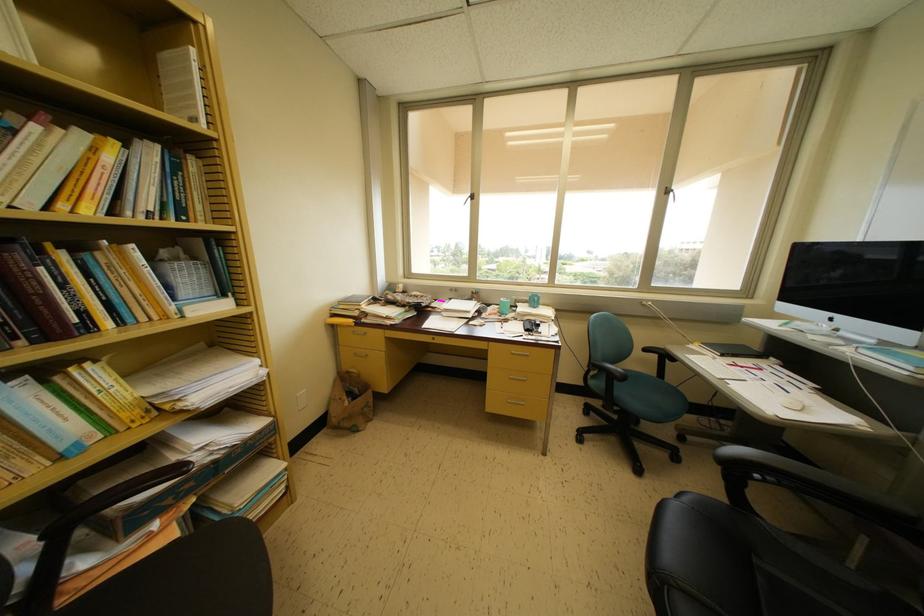
Where would you lift the white tissue holder? Please return your answer as a coordinate pair (x, y).

(184, 276)